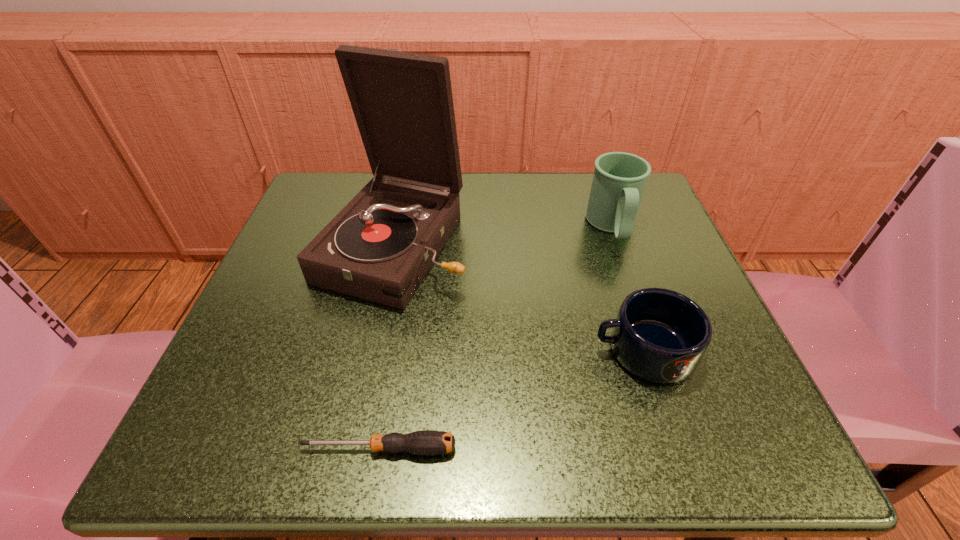
You are a GUI agent. You are given a task and a screenshot of the screen. Output one action in this format:
    pyautogui.click(x=<x>, y=<y>)
    Task: Click on the object that is at the far right corner
    The image size is (960, 540).
    Given the screenshot: What is the action you would take?
    pyautogui.click(x=619, y=179)

Locate an element on the screen. vacant space at the far edge of the desktop is located at coordinates (548, 211).

Locate an element on the screen. This screenshot has width=960, height=540. vacant region at the near edge of the desktop is located at coordinates [x=366, y=446].

The image size is (960, 540). I want to click on blank space at the right edge, so click(x=655, y=240).

Locate an element on the screen. Image resolution: width=960 pixels, height=540 pixels. free space at the far left corner of the desktop is located at coordinates (340, 181).

Locate an element on the screen. This screenshot has width=960, height=540. blank area at the near left corner is located at coordinates (283, 430).

In order to click on vacant region at the far right corner of the desktop in this screenshot , I will do `click(639, 210)`.

Where is `vacant area between the farther mug and the phonograph record`? The image size is (960, 540). vacant area between the farther mug and the phonograph record is located at coordinates (503, 237).

What are the coordinates of `free space between the third tallest object and the nearest object` in the screenshot? It's located at (511, 400).

Locate an element on the screen. This screenshot has height=540, width=960. free space between the nearest object and the third shortest object is located at coordinates (495, 338).